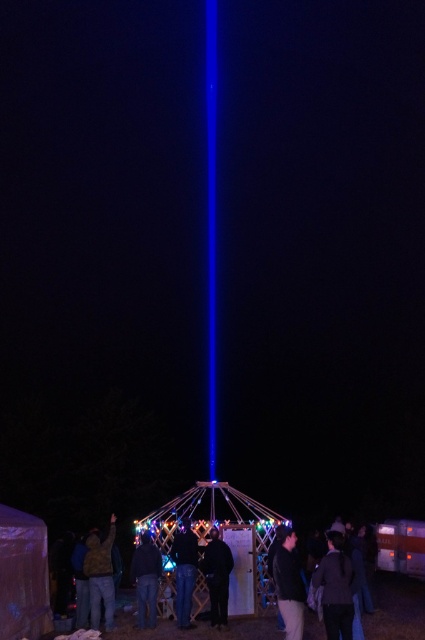
Which is more to the right, dark gray fabric at lower right or jeans at center?

Positioned to the right is dark gray fabric at lower right.

Who is shorter, dark gray fabric at lower right or jeans at center?

With less height is dark gray fabric at lower right.

Where is `dark gray fabric at lower right`? dark gray fabric at lower right is located at coordinates (336, 588).

Image resolution: width=425 pixels, height=640 pixels. Find the location of `dark gray fabric at lower right`. dark gray fabric at lower right is located at coordinates (336, 588).

Between dark gray fabric at lower right and brown leather jacket at lower left, which one is positioned higher?

dark gray fabric at lower right is higher up.

Does dark gray fabric at lower right appear over brown leather jacket at lower left?

Yes.

This screenshot has height=640, width=425. What do you see at coordinates (336, 588) in the screenshot?
I see `dark gray fabric at lower right` at bounding box center [336, 588].

Locate an element on the screen. dark gray fabric at lower right is located at coordinates (336, 588).

Is point (102, 554) more distant than point (184, 620)?

No, it is in front of (184, 620).

Is brown leather jacket at lower left above jeans at center?

Correct, brown leather jacket at lower left is located above jeans at center.

In order to click on brown leather jacket at lower left in this screenshot , I will do `click(101, 573)`.